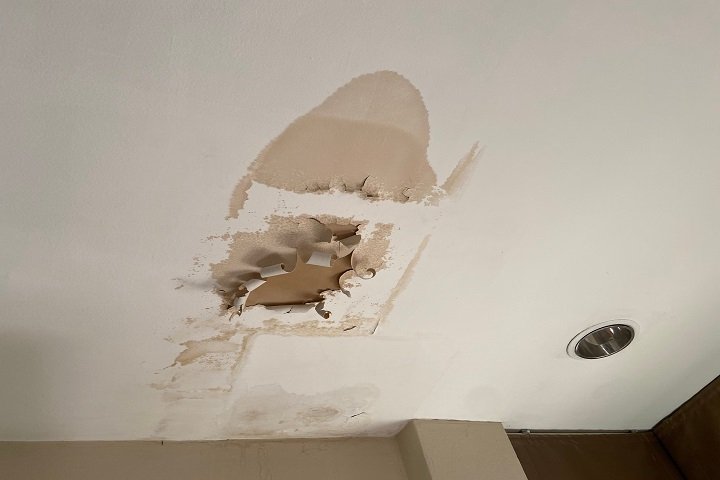
At what (x,y) coordinates should I click in order to perform the action: click on white circle around pot light. Please return your answer as a coordinate pair (x, y). This screenshot has width=720, height=480. Looking at the image, I should click on (572, 345).